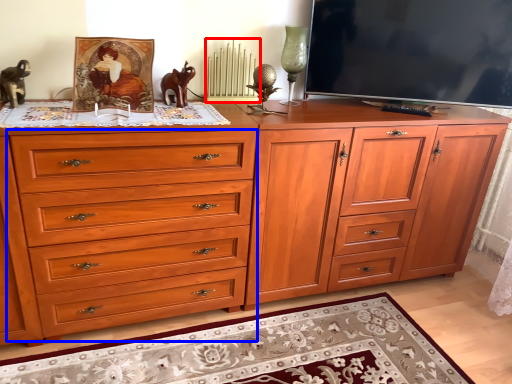
Question: Which object appears farthest to the camera in this image, radiator (highlighted by a red box) or drawer (highlighted by a blue box)?

Choices:
 (A) radiator
 (B) drawer

Answer: (A)